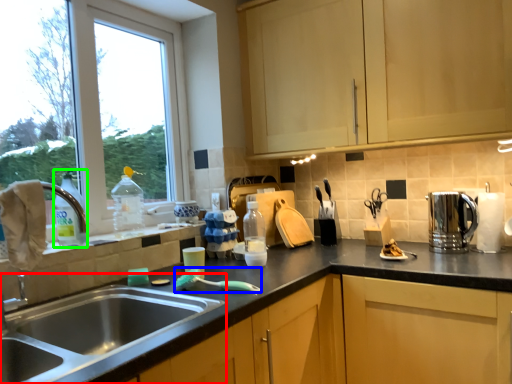
Question: Estimate the real-world distances between objects in this image. Which object is closer to sink (highlighted by a red box), brush (highlighted by a blue box) or bottle (highlighted by a green box)?

Choices:
 (A) brush
 (B) bottle

Answer: (A)